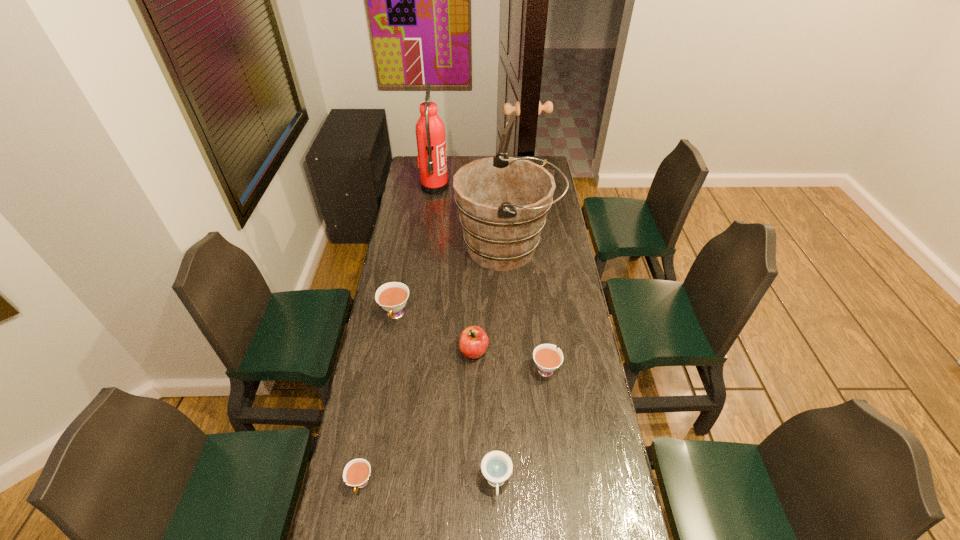
You are a GUI agent. You are given a task and a screenshot of the screen. Output one action in this format:
    pyautogui.click(x=<x>, y=<y>)
    Task: Click on the fire extinguisher
    The height and width of the screenshot is (540, 960).
    Given the screenshot: What is the action you would take?
    pyautogui.click(x=430, y=133)

Where is `the third farthest object`? The image size is (960, 540). the third farthest object is located at coordinates (503, 201).

I want to click on bucket, so click(503, 201).

The width and height of the screenshot is (960, 540). I want to click on phonograph record, so click(506, 134).

At what (x,y) coordinates should I click in order to perform the action: click on apple. Please return your answer as a coordinate pair (x, y). This screenshot has width=960, height=540. Looking at the image, I should click on click(x=473, y=343).

I want to click on the fifth nearest object, so click(392, 297).

Find the location of a particular element. the biggest white teacup is located at coordinates (392, 297).

You are a GUI agent. You are given a task and a screenshot of the screen. Output one action in this format:
    pyautogui.click(x=<x>, y=<y>)
    Task: Click on the second farthest teacup
    
    Given the screenshot: What is the action you would take?
    pyautogui.click(x=547, y=358)

Find the location of `the rightmost white teacup`. the rightmost white teacup is located at coordinates (547, 358).

The height and width of the screenshot is (540, 960). In order to click on the second teacup from right to left in this screenshot , I will do `click(496, 466)`.